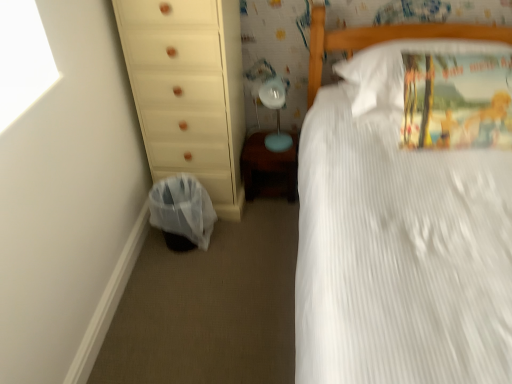
The width and height of the screenshot is (512, 384). Find the location of `space that is in front of white wood chest of drawers at left`. space that is in front of white wood chest of drawers at left is located at coordinates (218, 251).